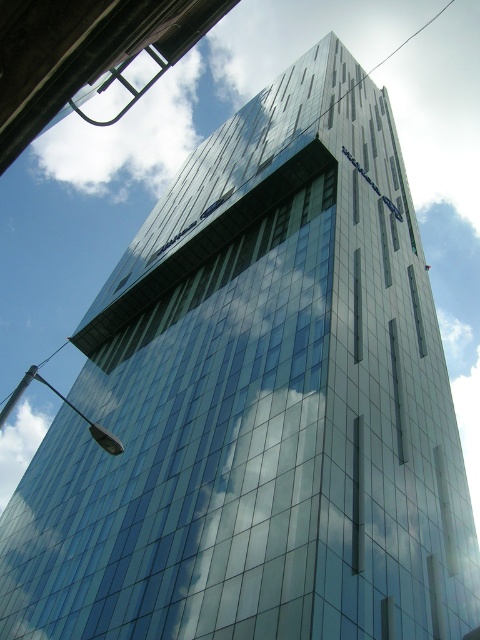
Question: Does white fluffy cloud at upper left have a greater width compared to white cloud at upper left?

Choices:
 (A) yes
 (B) no

Answer: (A)

Question: Is white fluffy cloud at upper left below transparent glass window at center?

Choices:
 (A) no
 (B) yes

Answer: (A)

Question: Which point is farther from the camera taking this photo?

Choices:
 (A) (120, 120)
 (B) (427, 353)
 (C) (32, 422)

Answer: (A)

Question: Among these objects, which one is farthest from the camera?

Choices:
 (A) white cloud at upper left
 (B) transparent glass window at center

Answer: (A)

Question: Considering the real-world distances, which object is farthest from the transparent glass window at center?

Choices:
 (A) white cloud at upper left
 (B) white fluffy cloud at upper left

Answer: (A)

Question: Does white fluffy cloud at upper left appear under white cloud at upper left?

Choices:
 (A) yes
 (B) no

Answer: (B)